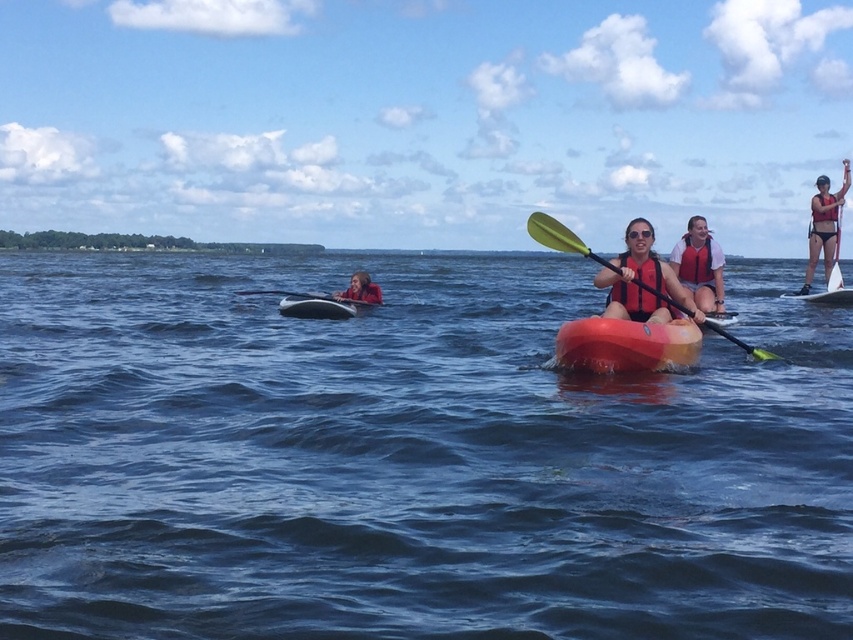
You are a safety inspector checking the placement of life preservers in the scene. You notice two red life preservers labeled as the matte red life vest at center and the matte red life jacket at upper right. Based on their positions, which one is located more to the left?

The matte red life vest at center is positioned to the left of the matte red life jacket at upper right, so the matte red life vest at center is more to the left.

From the picture: You are a lifeguard on duty and notice two life jackets in the water. One is the orange matte life jacket at center and the other is the red life jacket at center. Which life jacket is taller above the water surface?

The orange matte life jacket at center is taller than the red life jacket at center, so the orange one is taller above the water surface.

Based on the photo, you are a lifeguard on duty and notice two life jackets in the water. The scene shows an orange matte life jacket at center and a red life jacket at center. Which life jacket is located below the other?

The orange matte life jacket at center is positioned under the red life jacket at center, meaning the orange one is below the red one.